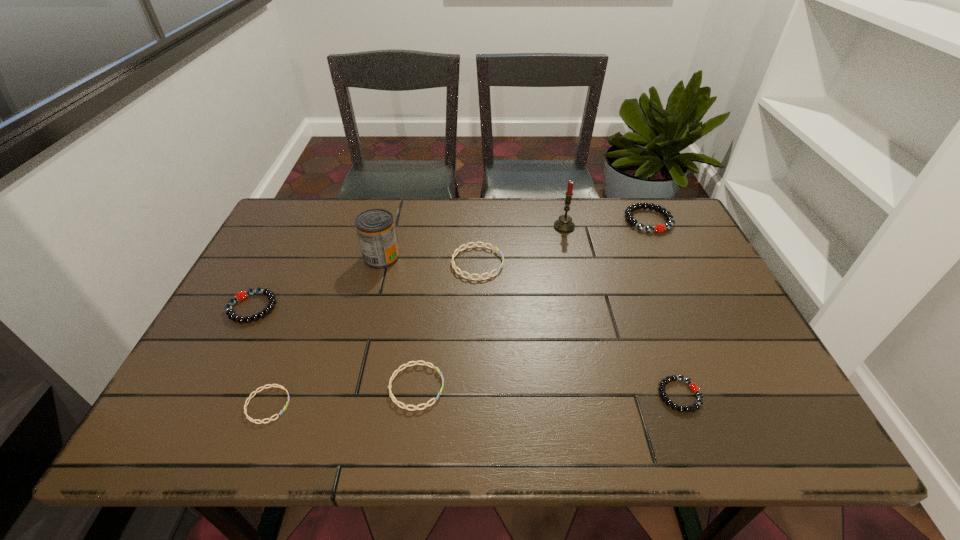
Locate an element on the screen. This screenshot has height=540, width=960. free point located 0.050m on the back of the nearest black bracelet is located at coordinates (666, 359).

The height and width of the screenshot is (540, 960). I want to click on vacant space located 0.150m on the surface of the shortest object showing star-shaped elements, so click(361, 405).

Locate an element on the screen. Image resolution: width=960 pixels, height=540 pixels. candle that is at the far edge is located at coordinates (564, 224).

Identify the location of bracelet present at the far edge. (630, 219).

Find the location of a particular element. object present at the right edge is located at coordinates (630, 219).

Where is `object located in the near left corner section of the desktop`? object located in the near left corner section of the desktop is located at coordinates (271, 385).

This screenshot has width=960, height=540. Find the location of `object that is positioned at the far right corner`. object that is positioned at the far right corner is located at coordinates point(630,219).

This screenshot has height=540, width=960. I want to click on vacant space at the far edge of the desktop, so click(580, 213).

I want to click on free space at the near edge of the desktop, so click(606, 427).

In the image, there is a desktop. Identify the location of vacant space at the left edge. click(203, 401).